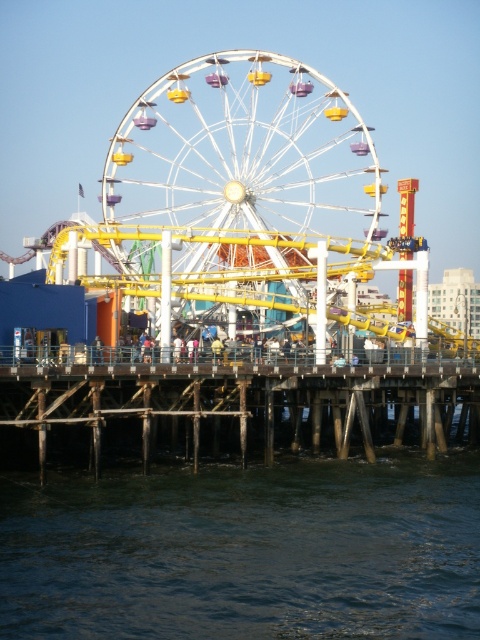
You are standing at the center of the amusement park and want to reach the dark blue water at lower center. What direction should you move in to get there?

Since the dark blue water at lower center is located at point [245,550], you should move towards the lower center direction to reach it.

Please look at the image. There is a point at coordinates (245, 550). What object is located at that point?

The dark blue water at lower center is located at point (245, 550).